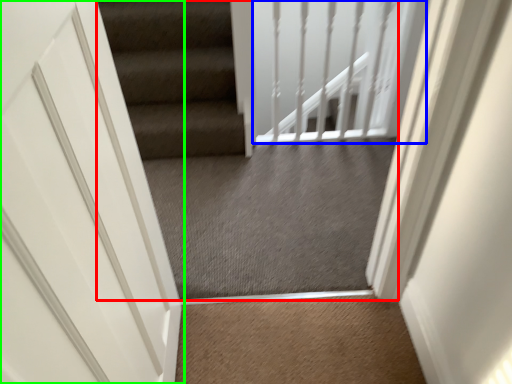
Question: Based on their relative distances, which object is nearer to escalator (highlighted by a red box)? Choose from balustrade (highlighted by a blue box) and door (highlighted by a green box).

Choices:
 (A) balustrade
 (B) door

Answer: (A)